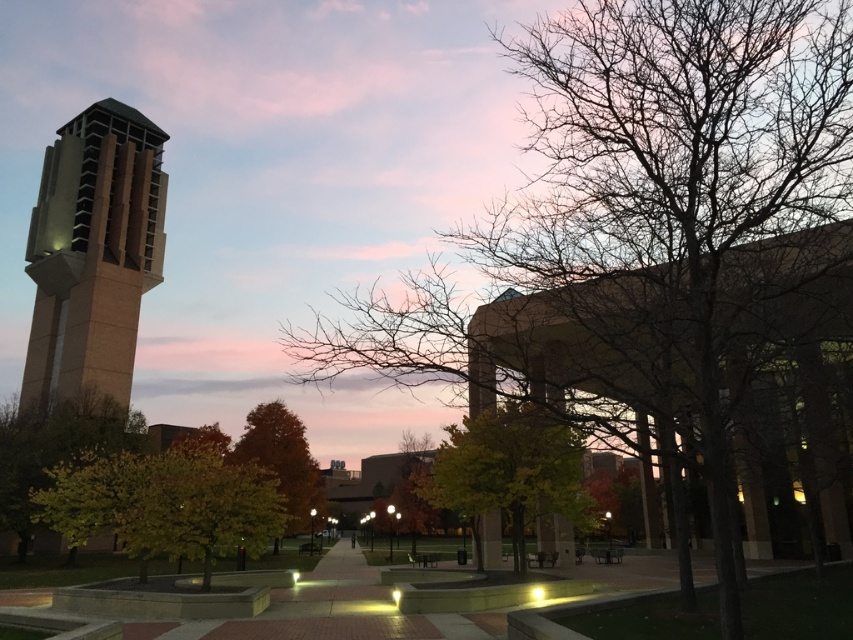
Based on the photo, does golden yellow leaves at center appear on the right side of green leafy tree at center?

Incorrect, golden yellow leaves at center is not on the right side of green leafy tree at center.

Which is below, golden yellow leaves at center or green leafy tree at center?

golden yellow leaves at center is lower down.

Identify the location of golden yellow leaves at center. The height and width of the screenshot is (640, 853). (165, 502).

Which of these two, bare branches at center or sandy beige stone bell tower at left, stands taller?

sandy beige stone bell tower at left is taller.

Can you confirm if bare branches at center is positioned to the right of sandy beige stone bell tower at left?

Yes, bare branches at center is to the right of sandy beige stone bell tower at left.

Between point (548, 276) and point (57, 172), which one is positioned in front?

Point (548, 276)

Find the location of a particular element. The height and width of the screenshot is (640, 853). bare branches at center is located at coordinates (646, 234).

Can you confirm if bare branches at center is wider than green leafy tree at left?

In fact, bare branches at center might be narrower than green leafy tree at left.

Does point (780, 20) come in front of point (49, 419)?

Yes.

At what (x,y) coordinates should I click in order to perform the action: click on bare branches at center. Please return your answer as a coordinate pair (x, y). The image size is (853, 640). Looking at the image, I should click on (646, 234).